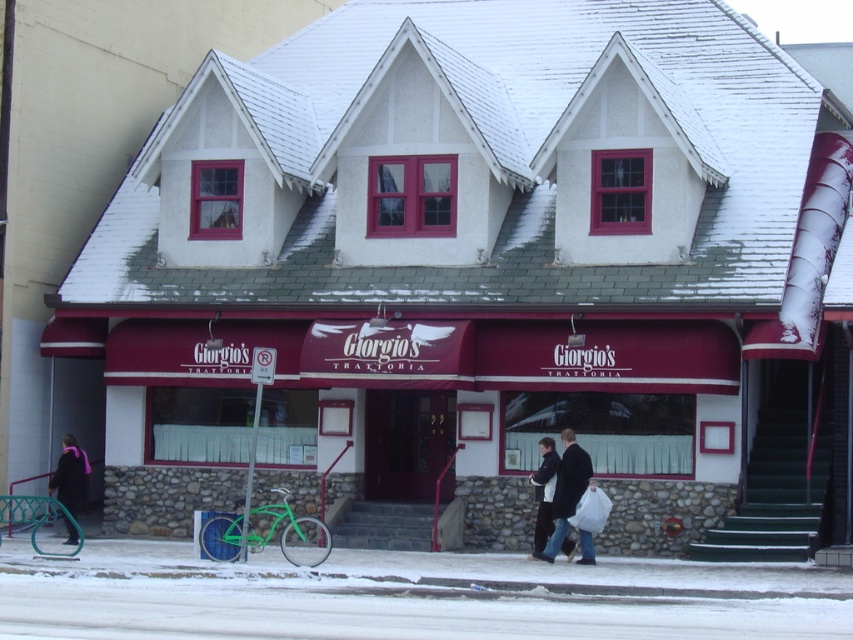
You are a customer approaching Giorgio Trattoria and see the white snow at lower center and the velvet purple scarf at lower left. Which object is closer to the entrance of the building?

The velvet purple scarf at lower left is closer to the entrance of the building because it is above the white snow at lower center, which is located below it.